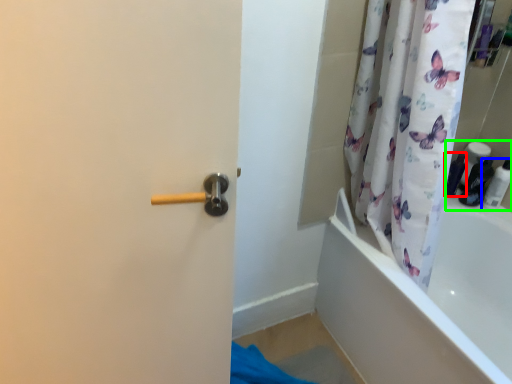
Question: Estimate the real-world distances between objects in this image. Which object is closer to toiletry (highlighted by a red box), toiletry (highlighted by a blue box) or toiletry (highlighted by a green box)?

Choices:
 (A) toiletry
 (B) toiletry

Answer: (B)